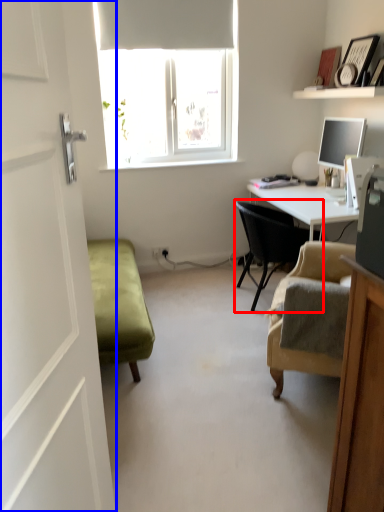
Question: Among these objects, which one is nearest to the camera, chair (highlighted by a red box) or screen door (highlighted by a blue box)?

Choices:
 (A) chair
 (B) screen door

Answer: (B)